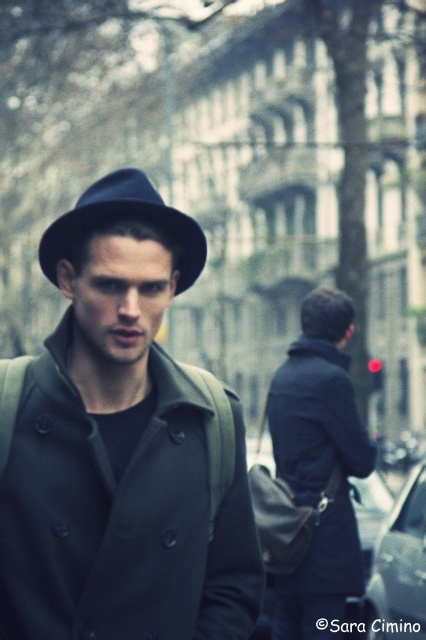
You are a photographer trying to capture both the dark blue leather jacket at center and the matte black fedora at center in a single shot. Which object should you adjust your camera angle to focus on first to ensure both are in frame?

The dark blue leather jacket at center is much taller than the matte black fedora at center, so you should focus on the dark blue leather jacket at center first to ensure both are in frame.